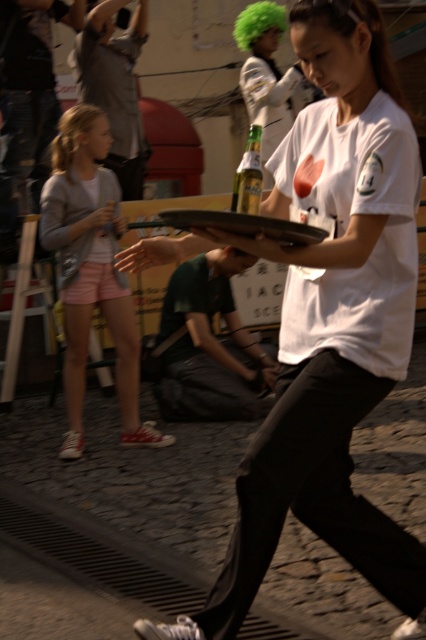
Is the position of light pink denim shorts at left more distant than that of gray cotton shirt at upper left?

That is False.

Find the location of `light pink denim shorts at left`. light pink denim shorts at left is located at coordinates (91, 269).

Can you confirm if light pink denim shorts at left is shorter than green glass bottle at center?

In fact, light pink denim shorts at left may be taller than green glass bottle at center.

Image resolution: width=426 pixels, height=640 pixels. What do you see at coordinates (91, 269) in the screenshot? I see `light pink denim shorts at left` at bounding box center [91, 269].

The height and width of the screenshot is (640, 426). Describe the element at coordinates (91, 269) in the screenshot. I see `light pink denim shorts at left` at that location.

What are the coordinates of `light pink denim shorts at left` in the screenshot? It's located at (91, 269).

Who is positioned more to the right, dark green fabric shirt at center or green glass bottle at center?

green glass bottle at center

Who is lower down, dark green fabric shirt at center or green glass bottle at center?

Positioned lower is dark green fabric shirt at center.

Is point (196, 257) in front of point (239, 172)?

That is False.

The width and height of the screenshot is (426, 640). Identify the location of dark green fabric shirt at center. (210, 346).